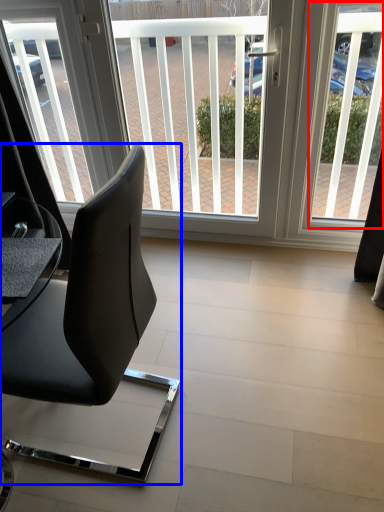
Question: Which object appears closest to the camera in this image, window screen (highlighted by a red box) or chair (highlighted by a blue box)?

Choices:
 (A) window screen
 (B) chair

Answer: (B)